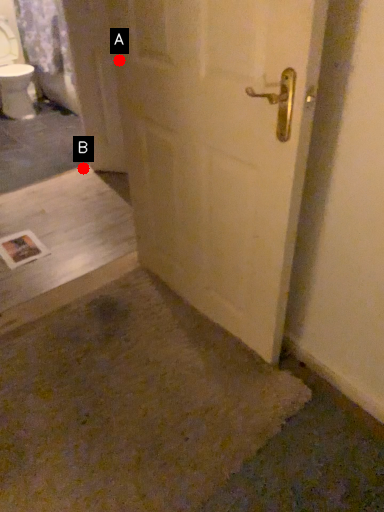
Question: Two points are circled on the image, labeled by A and B beside each circle. Which point appears farthest from the camera in this image?

Choices:
 (A) A is further
 (B) B is further

Answer: (B)